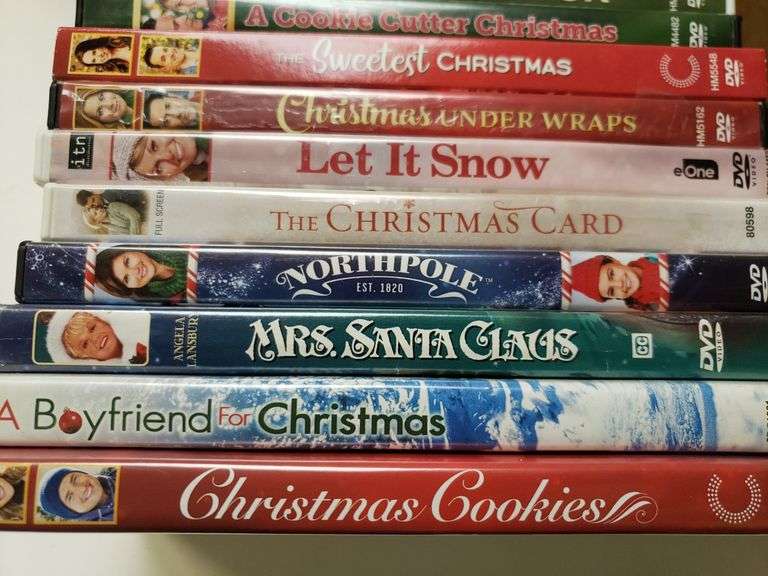
At what (x,y) coordinates should I click in order to perform the action: click on dvd cases. Please return your answer as a coordinate pair (x, y). The image size is (768, 576). Looking at the image, I should click on click(422, 502), click(437, 422), click(449, 353), click(454, 290), click(462, 233), click(462, 157), click(475, 120), click(492, 62), click(518, 14).